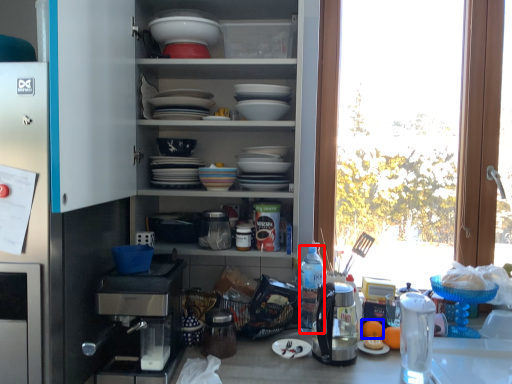
Question: Which point is closer to the camera, bottle (highlighted by a red box) or orange juice (highlighted by a blue box)?

Choices:
 (A) bottle
 (B) orange juice

Answer: (B)